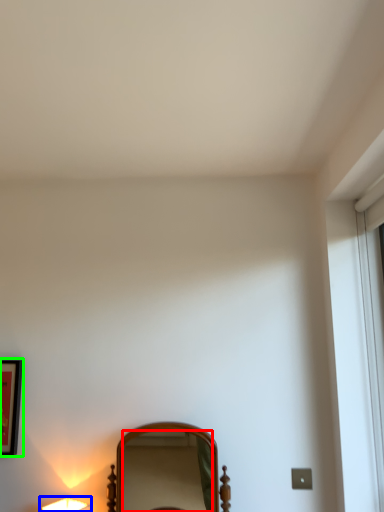
Question: Which is farther away from mirror (highlighted by a red box)? lamp (highlighted by a blue box) or picture frame (highlighted by a green box)?

Choices:
 (A) lamp
 (B) picture frame

Answer: (A)